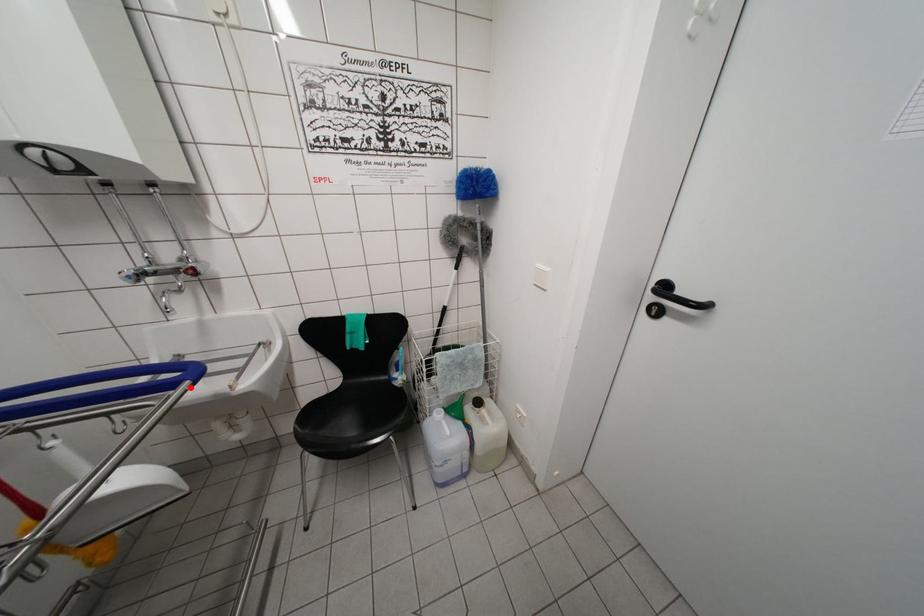
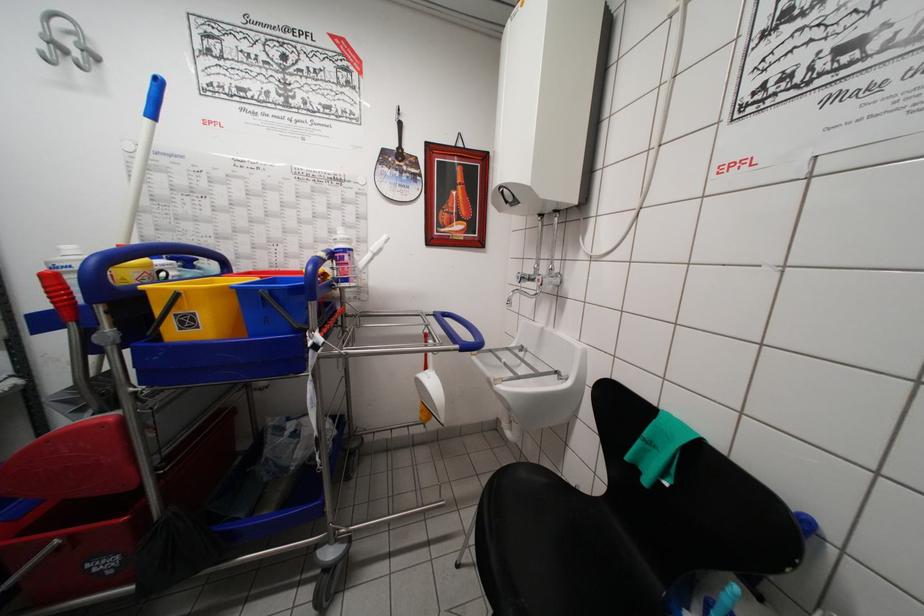
Question: I am providing you with two images of the same scene from different viewpoints. Image1 has a red point marked. In image2, the corresponding 3D location appears at what relative position? Reply with the corresponding letter.

Choices:
 (A) Closer
 (B) Farther

Answer: (B)